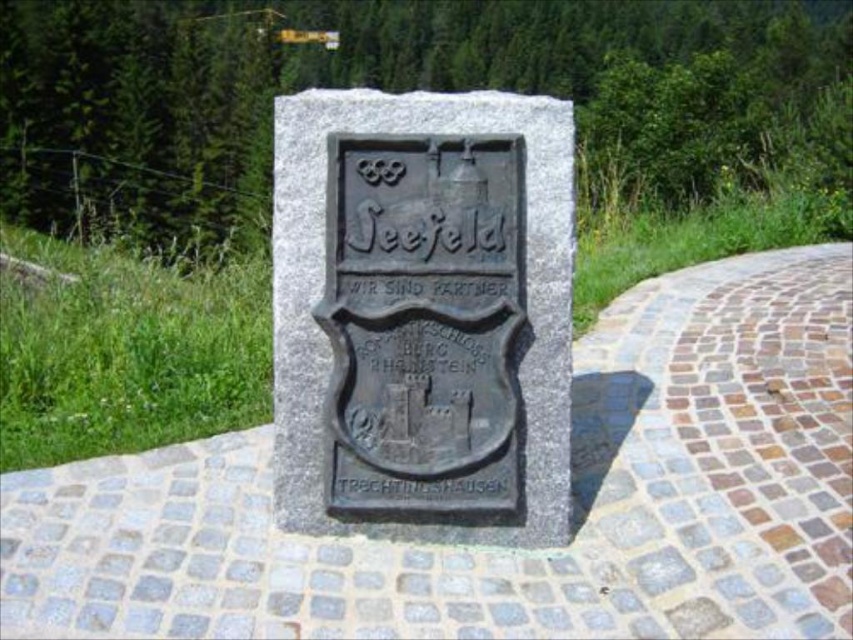
Question: From the image, what is the correct spatial relationship of gray stone path at center in relation to bronze plaque at center?

Choices:
 (A) right
 (B) left

Answer: (A)

Question: Does gray stone path at center appear on the left side of bronze plaque at center?

Choices:
 (A) no
 (B) yes

Answer: (A)

Question: Which object appears closest to the camera in this image?

Choices:
 (A) gray stone path at center
 (B) black stone sign at center

Answer: (A)

Question: Among these objects, which one is farthest from the camera?

Choices:
 (A) black stone sign at center
 (B) bronze plaque at center
 (C) gray stone path at center

Answer: (A)

Question: Is gray stone path at center closer to the viewer compared to bronze plaque at center?

Choices:
 (A) yes
 (B) no

Answer: (A)

Question: Which point is farther to the camera?

Choices:
 (A) (247, 522)
 (B) (294, 317)
 (C) (445, 476)

Answer: (A)